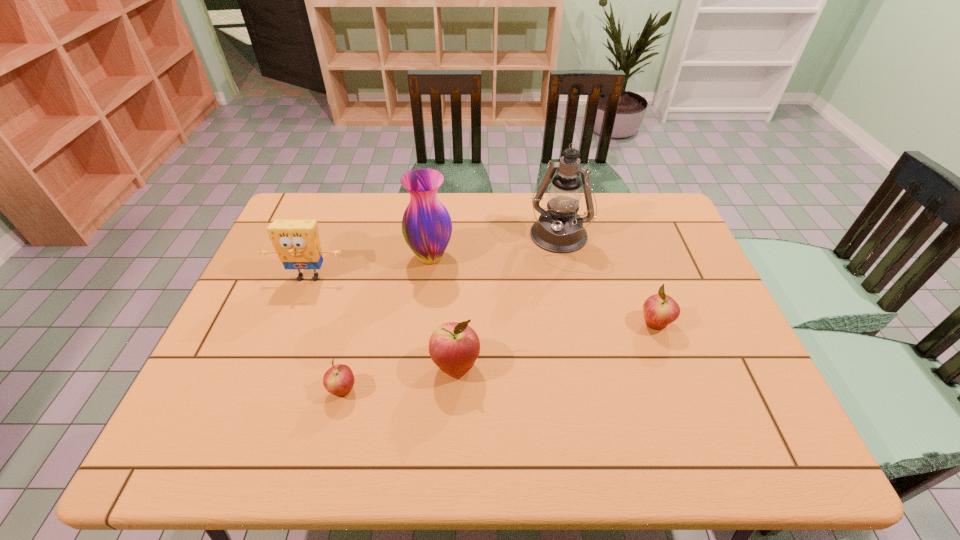
If equal spacing is desired by inserting an extra apple among them, please point out a free spot for this new apple. Please provide its 2D coordinates. Your answer should be formatted as a tuple, i.e. [(x, y)], where the tuple contains the x and y coordinates of a point satisfying the conditions above.

[(560, 344)]